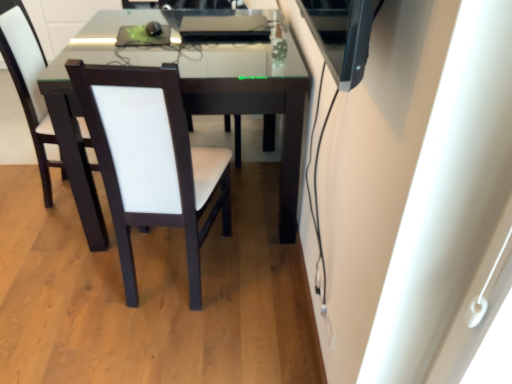
Question: Would you say white leather chair at center, which is counted as the 3th chair, starting from the left, contains white leather chair at center, which ranks as the 2th chair in right-to-left order?

Choices:
 (A) no
 (B) yes

Answer: (A)

Question: From the image's perspective, would you say white leather chair at center, the 1th chair from the right, is shown under white leather chair at center, the 2th chair in the left-to-right sequence?

Choices:
 (A) yes
 (B) no

Answer: (B)

Question: From a real-world perspective, is white leather chair at center, the 1th chair from the right, on top of white leather chair at center, the 2th chair in the left-to-right sequence?

Choices:
 (A) yes
 (B) no

Answer: (B)

Question: Considering the relative sizes of white leather chair at center, which is counted as the 3th chair, starting from the left, and white leather chair at center, the 2th chair in the left-to-right sequence, in the image provided, is white leather chair at center, which is counted as the 3th chair, starting from the left, wider than white leather chair at center, the 2th chair in the left-to-right sequence,?

Choices:
 (A) yes
 (B) no

Answer: (A)

Question: Is white leather chair at center, the 1th chair from the right, thinner than white leather chair at center, the 2th chair in the left-to-right sequence?

Choices:
 (A) no
 (B) yes

Answer: (A)

Question: Is white leather chair at center, the third chair in the right-to-left sequence, taller or shorter than white leather chair at center, the 2th chair in the left-to-right sequence?

Choices:
 (A) tall
 (B) short

Answer: (B)

Question: Looking at their shapes, would you say white leather chair at center, the third chair in the right-to-left sequence, is wider or thinner than white leather chair at center, which ranks as the 2th chair in right-to-left order?

Choices:
 (A) wide
 (B) thin

Answer: (B)

Question: Do you think white leather chair at center, which appears as the 1th chair when viewed from the left, is within white leather chair at center, which ranks as the 2th chair in right-to-left order, or outside of it?

Choices:
 (A) inside
 (B) outside

Answer: (B)

Question: From a real-world perspective, is white leather chair at center, which appears as the 1th chair when viewed from the left, positioned above or below white leather chair at center, which ranks as the 2th chair in right-to-left order?

Choices:
 (A) below
 (B) above

Answer: (B)

Question: Is white leather chair at center, the 2th chair in the left-to-right sequence, to the left or to the right of white leather chair at center, which is counted as the 3th chair, starting from the left, in the image?

Choices:
 (A) left
 (B) right

Answer: (A)

Question: From the image's perspective, is white leather chair at center, which ranks as the 2th chair in right-to-left order, positioned above or below white leather chair at center, which is counted as the 3th chair, starting from the left?

Choices:
 (A) below
 (B) above

Answer: (A)

Question: From a real-world perspective, is white leather chair at center, which ranks as the 2th chair in right-to-left order, physically located above or below white leather chair at center, which is counted as the 3th chair, starting from the left?

Choices:
 (A) below
 (B) above

Answer: (B)

Question: Looking at the image, does white leather chair at center, which ranks as the 2th chair in right-to-left order, seem bigger or smaller compared to white leather chair at center, the 1th chair from the right?

Choices:
 (A) small
 (B) big

Answer: (A)

Question: Considering the positions of point (124, 228) and point (13, 64), is point (124, 228) closer or farther from the camera than point (13, 64)?

Choices:
 (A) closer
 (B) farther

Answer: (A)

Question: From a real-world perspective, is white leather chair at center, the 2th chair in the left-to-right sequence, above or below white leather chair at center, which appears as the 1th chair when viewed from the left?

Choices:
 (A) below
 (B) above

Answer: (A)